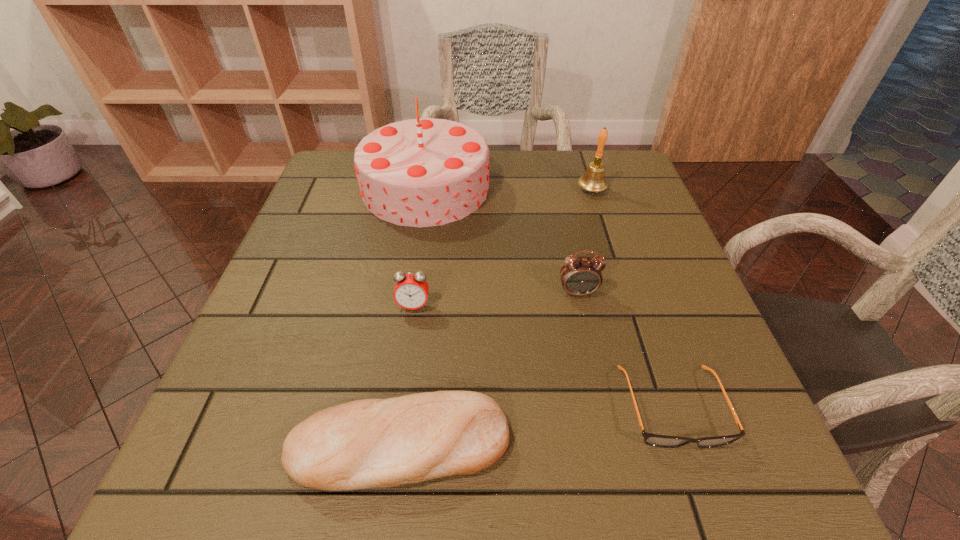
Identify the location of free space that is in between the tallest object and the bread. (413, 316).

Locate an element on the screen. The width and height of the screenshot is (960, 540). free space between the second tallest object and the third tallest object is located at coordinates (585, 241).

Locate an element on the screen. Image resolution: width=960 pixels, height=540 pixels. vacant space in between the right alarm clock and the left alarm clock is located at coordinates (495, 299).

You are a GUI agent. You are given a task and a screenshot of the screen. Output one action in this format:
    pyautogui.click(x=<x>, y=<y>)
    Task: Click on the free area in between the tallest object and the shorter alarm clock
    
    Given the screenshot: What is the action you would take?
    pyautogui.click(x=420, y=247)

Identify the location of empty space between the shortest object and the fifth shortest object. The image size is (960, 540). (633, 298).

At what (x,y) coordinates should I click in order to perform the action: click on free space between the bread and the spectacles. Please return your answer as a coordinate pair (x, y). Image resolution: width=960 pixels, height=540 pixels. Looking at the image, I should click on (537, 425).

Locate an element on the screen. This screenshot has width=960, height=540. empty space between the birthday cake and the second tallest object is located at coordinates [509, 189].

Locate an element on the screen. free space between the bell and the tallest object is located at coordinates (509, 189).

Select which object is the fifth closest to the shortest object. Please provide its 2D coordinates. Your answer should be formatted as a tuple, i.e. [(x, y)], where the tuple contains the x and y coordinates of a point satisfying the conditions above.

[(593, 180)]

At what (x,y) coordinates should I click in order to perform the action: click on object that is the fourth closest to the left alarm clock. Please return your answer as a coordinate pair (x, y). Looking at the image, I should click on (655, 440).